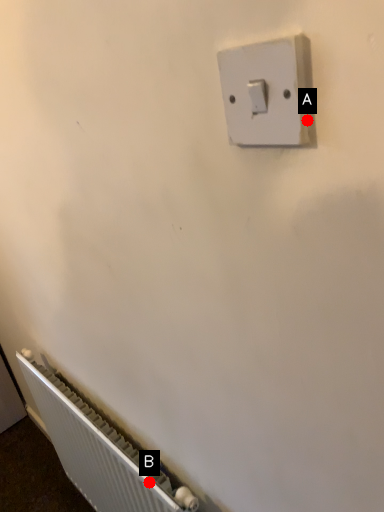
Question: Two points are circled on the image, labeled by A and B beside each circle. Which point is closer to the camera?

Choices:
 (A) A is closer
 (B) B is closer

Answer: (A)